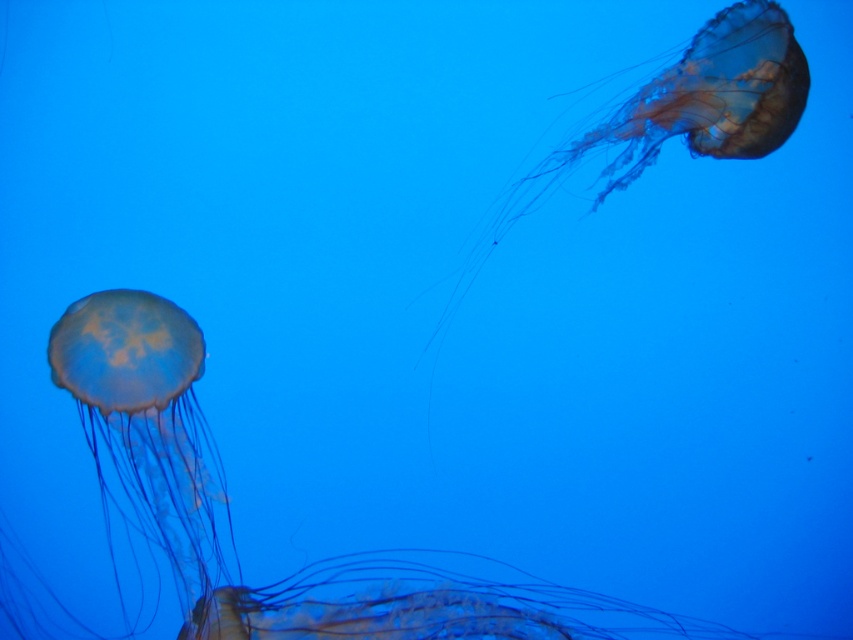
Does translucent yellow jellyfish at lower left appear over translucent gelatinous at upper right?

Incorrect, translucent yellow jellyfish at lower left is not positioned above translucent gelatinous at upper right.

Between point (123, 560) and point (724, 148), which one is positioned behind?

The point (724, 148) is behind.

This screenshot has width=853, height=640. I want to click on translucent yellow jellyfish at lower left, so click(231, 522).